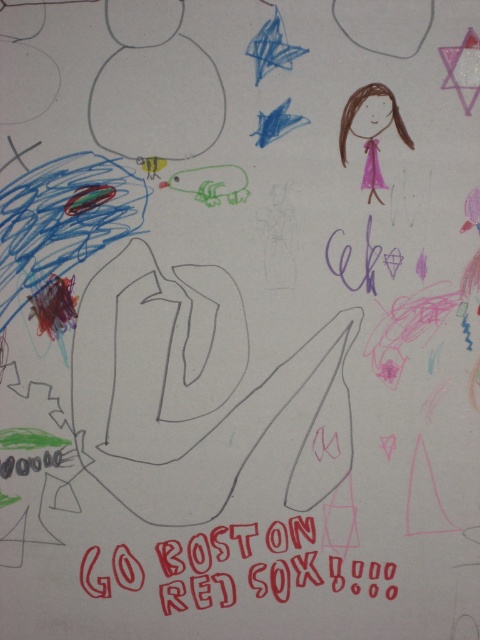
You are an art teacher reviewing a student artwork. The artwork has a red paper text at center and a pink paper doll at upper right. Based on their positions, which object is located more to the left?

The red paper text at center is positioned on the left side of the pink paper doll at upper right, so the red paper text at center is more to the left.

You are standing in front of a large mural that is 2 meters tall. The mural has a central text saying GO BOSTON RED SOX. If the red paper text at center is 1.92 meters away from you, can you see the entire mural without moving your head?

The red paper text at center is 1.92 meters away from the viewer. Since the mural is 2 meters tall, and the text is near the center, the entire mural would extend slightly beyond the viewing distance. You might need to move your head slightly to see the top or bottom parts.

You are a teacher organizing a classroom wall display. You have two items to hang on a bulletin board that is 30 inches wide. The items are the red paper text at center and the pink paper doll at upper right. Can both items fit side by side on the bulletin board without overlapping?

The red paper text at center and pink paper doll at upper right are 31.28 inches apart from each other. Since the bulletin board is only 30 inches wide, the two items cannot fit side by side without overlapping.